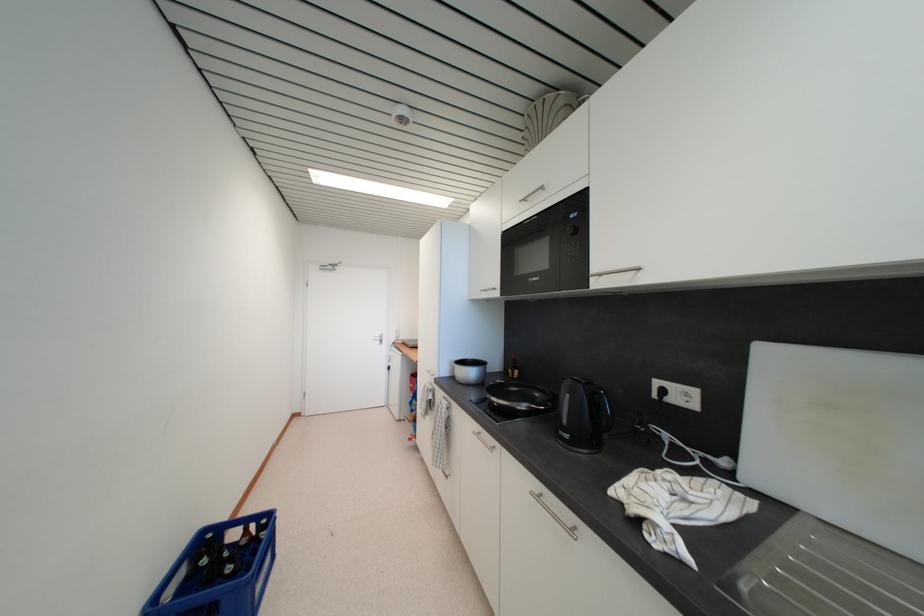
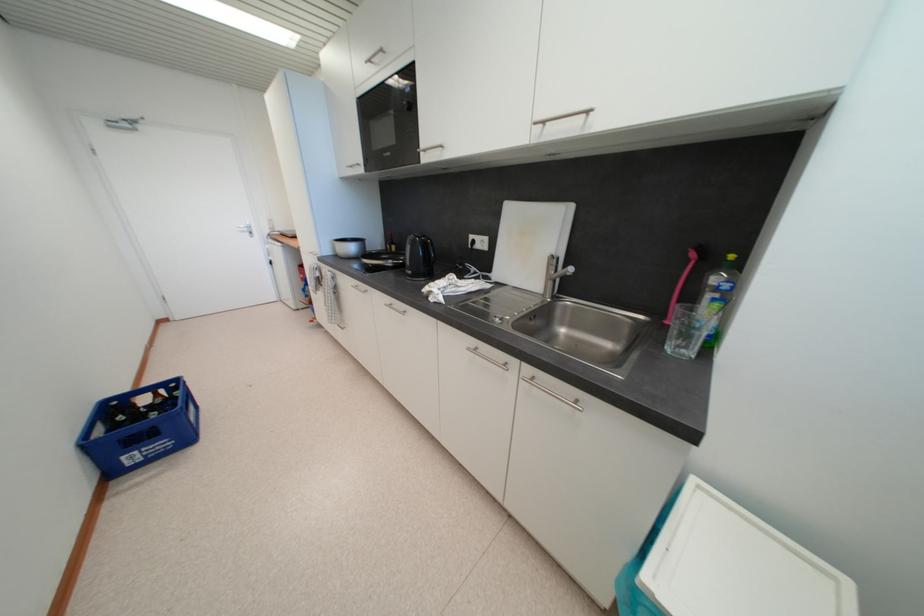
In the second image, find the point that corresponds to point (531, 407) in the first image.

(395, 264)